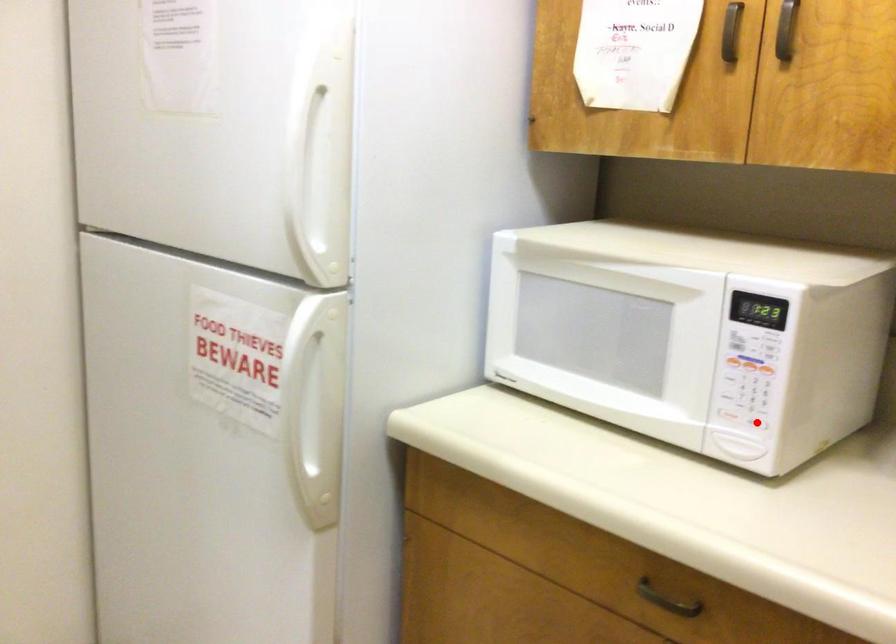
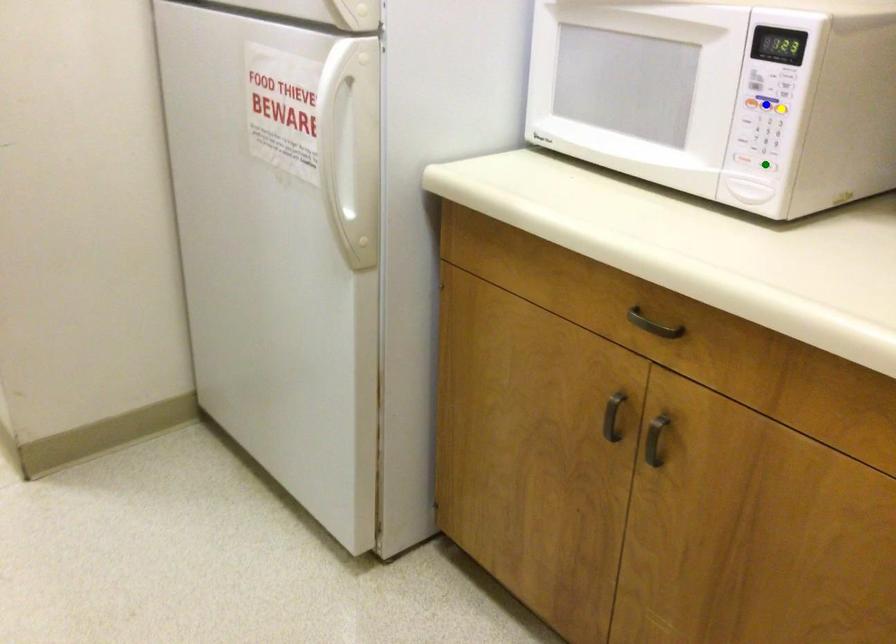
Question: I am providing you with two images of the same scene from different viewpoints. A red point is marked on the first image. You are given multiple points on the second image. Which mark in image 2 goes with the point in image 1?

Choices:
 (A) green point
 (B) yellow point
 (C) blue point

Answer: (A)